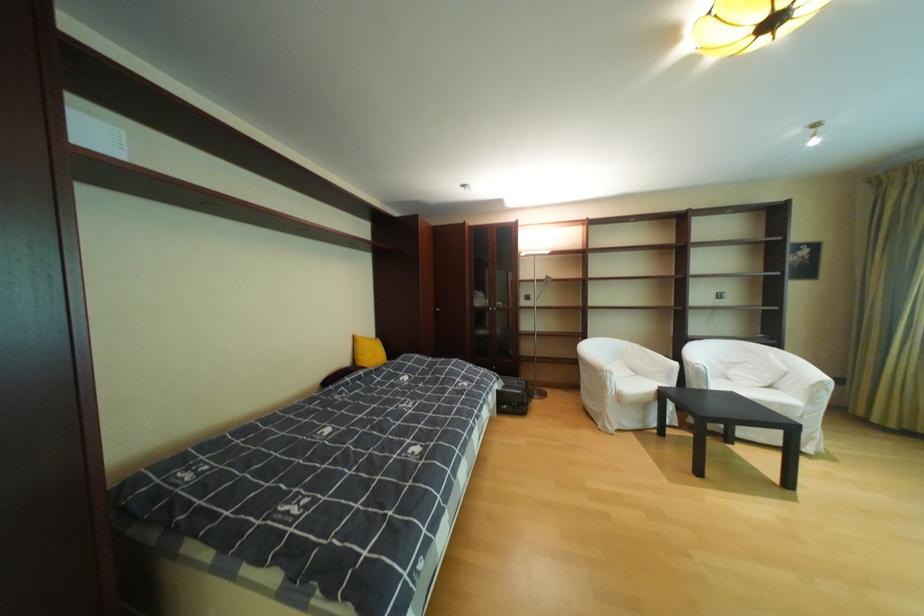
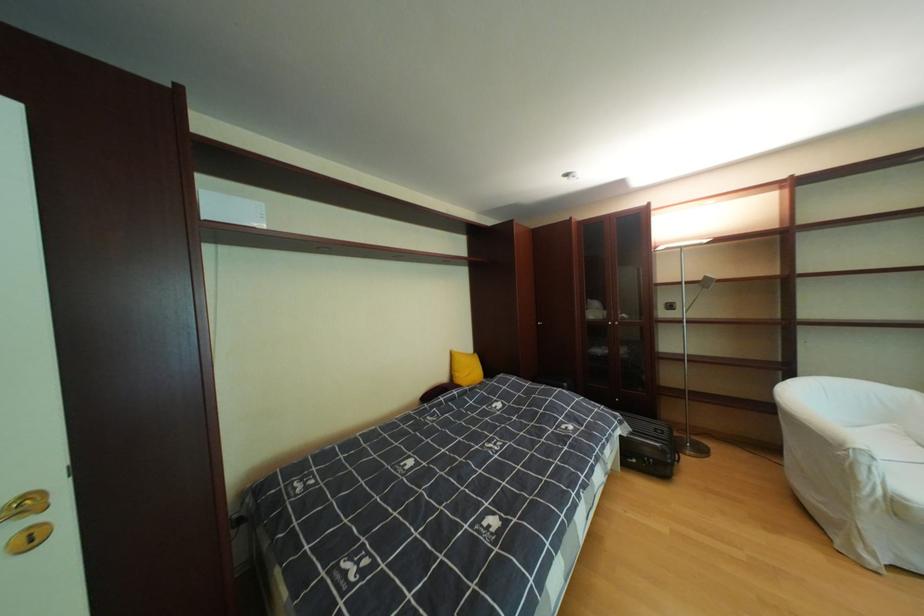
Locate, in the second image, the point that corresponds to pixel 550 282 in the first image.

(699, 284)